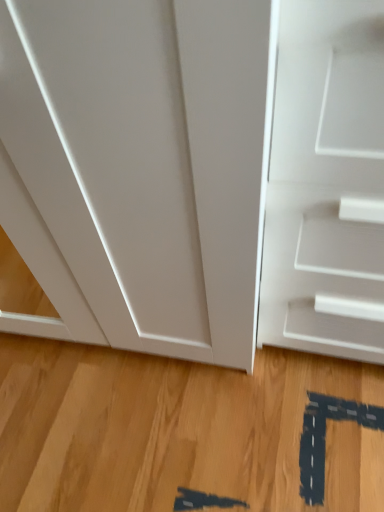
Question: Is light brown wood flooring at center at the right side of white matte door at right?

Choices:
 (A) no
 (B) yes

Answer: (A)

Question: Is light brown wood flooring at center closer to camera compared to white matte door at right?

Choices:
 (A) no
 (B) yes

Answer: (A)

Question: Is light brown wood flooring at center looking in the opposite direction of white matte door at right?

Choices:
 (A) yes
 (B) no

Answer: (B)

Question: Can white matte door at right be found inside light brown wood flooring at center?

Choices:
 (A) yes
 (B) no

Answer: (B)

Question: Considering the relative sizes of light brown wood flooring at center and white matte door at right in the image provided, is light brown wood flooring at center thinner than white matte door at right?

Choices:
 (A) yes
 (B) no

Answer: (B)

Question: Does light brown wood flooring at center have a larger size compared to white matte door at right?

Choices:
 (A) yes
 (B) no

Answer: (B)

Question: Is white matte door at right taller than light brown wood flooring at center?

Choices:
 (A) yes
 (B) no

Answer: (A)

Question: Does white matte door at right have a larger size compared to light brown wood flooring at center?

Choices:
 (A) yes
 (B) no

Answer: (A)

Question: Are white matte door at right and light brown wood flooring at center far apart?

Choices:
 (A) no
 (B) yes

Answer: (A)

Question: Is white matte door at right not within light brown wood flooring at center?

Choices:
 (A) yes
 (B) no

Answer: (A)

Question: Does white matte door at right appear on the left side of light brown wood flooring at center?

Choices:
 (A) no
 (B) yes

Answer: (A)

Question: From a real-world perspective, is white matte door at right positioned under light brown wood flooring at center based on gravity?

Choices:
 (A) yes
 (B) no

Answer: (B)

Question: From a real-world perspective, relative to light brown wood flooring at center, is white matte door at right vertically above or below?

Choices:
 (A) above
 (B) below

Answer: (A)